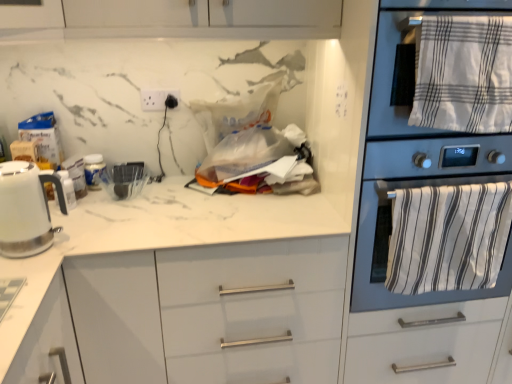
Locate an element on the screen. This screenshot has width=512, height=384. blank space above white striped towel at upper right, the 1th bath towel viewed from the top (from a real-world perspective) is located at coordinates (464, 12).